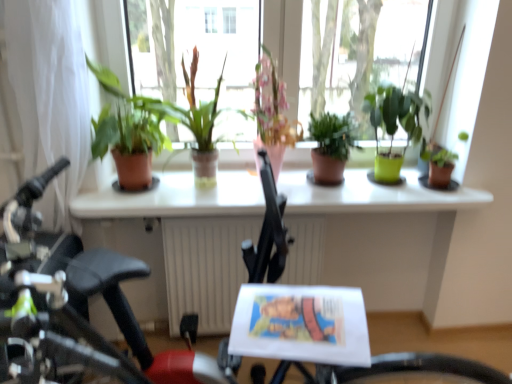
This screenshot has height=384, width=512. Identify the location of free spot below terracotta pot at center, acting as the 2th houseplant starting from the left (from a real-world perspective). (195, 183).